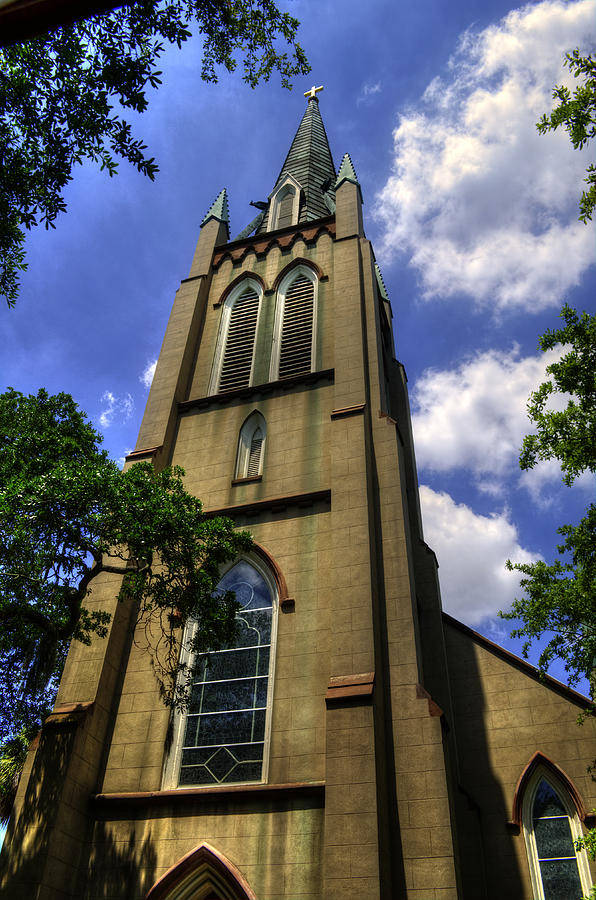
Image resolution: width=596 pixels, height=900 pixels. Find the location of `window frames`. window frames is located at coordinates (275, 626), (529, 830).